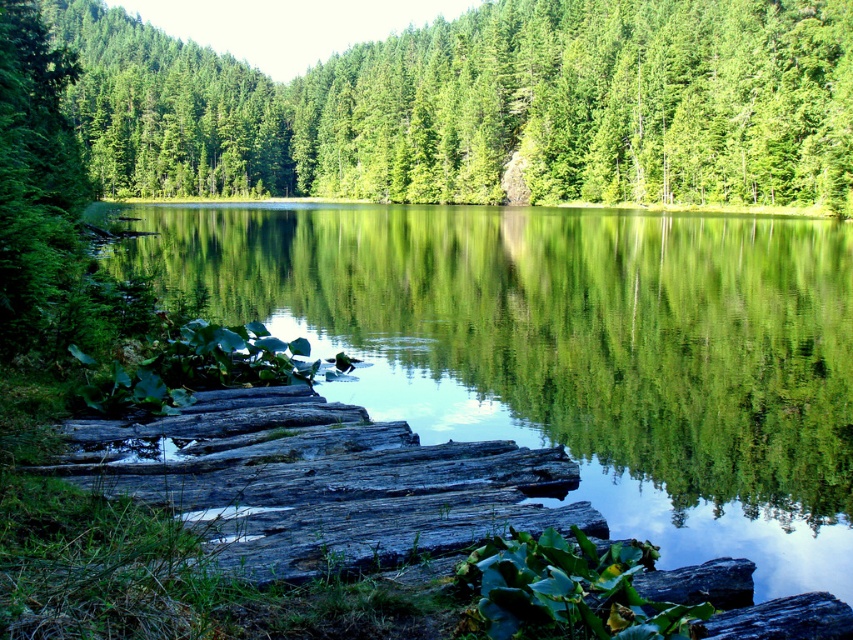
You are standing on the smooth wooden dock at center and want to see the top of the green matte tree at center. Can you see the entire tree from your current position?

The smooth wooden dock at center is not as tall as the green matte tree at center, so you can see the entire tree from your current position.

You are standing at the edge of the water and want to place a small bench on the smooth wooden dock at center so that it doesn not block the view of the green matte tree at center. Is the dock large enough to accommodate the bench without obstructing the tree?

The smooth wooden dock at center occupies less space than the green matte tree at center, so placing the bench on the dock might block the view of the tree since the dock is smaller in size compared to the tree.

You are standing at the edge of the water in the serene landscape. You notice a point marked at coordinates (573, 349). What object is located at this point?

The point at coordinates (573, 349) marks the location of the smooth wooden dock at center.